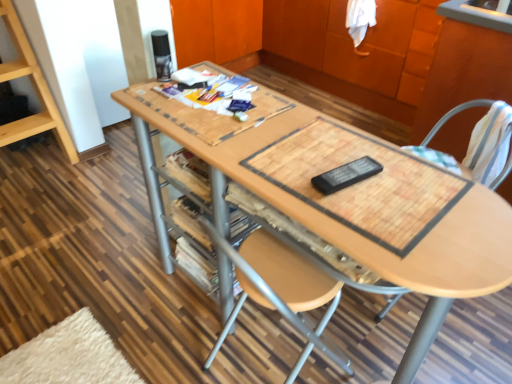
Question: Looking at the image, does bamboo placemat at center seem bigger or smaller compared to wooden cabinet at upper center?

Choices:
 (A) small
 (B) big

Answer: (A)

Question: Considering the positions of point (324, 150) and point (382, 77), is point (324, 150) closer or farther from the camera than point (382, 77)?

Choices:
 (A) farther
 (B) closer

Answer: (B)

Question: Which of these objects is positioned farthest from the wooden cabinet at upper center?

Choices:
 (A) white striped fabric swivel chair at right
 (B) wooden table at center
 (C) bamboo placemat at center
 (D) wooden at right

Answer: (C)

Question: Estimate the real-world distances between objects in this image. Which object is farther from the wooden table at center?

Choices:
 (A) bamboo placemat at center
 (B) white striped fabric swivel chair at right
 (C) wooden at right
 (D) wooden cabinet at upper center

Answer: (D)